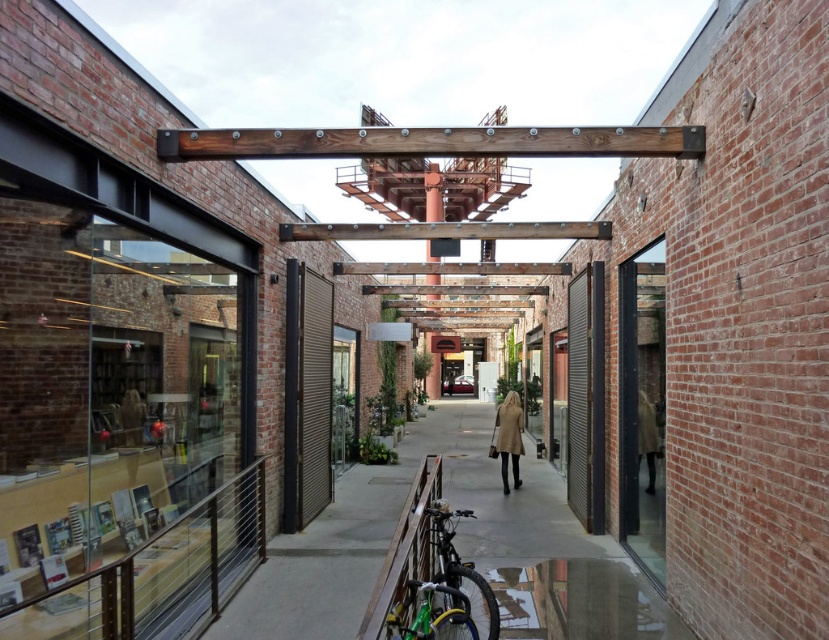
Question: Which is nearer to the green matte bicycle at lower center?

Choices:
 (A) matte beige trench coat at center
 (B) beige wool coat at center

Answer: (B)

Question: Which is nearer to the green matte bicycle at lower center?

Choices:
 (A) matte beige trench coat at center
 (B) beige wool coat at center

Answer: (B)

Question: Does green matte bicycle at lower center appear on the right side of matte beige trench coat at center?

Choices:
 (A) yes
 (B) no

Answer: (B)

Question: Does green matte bicycle at lower center have a larger size compared to beige wool coat at center?

Choices:
 (A) yes
 (B) no

Answer: (B)

Question: Which object is the farthest from the matte beige trench coat at center?

Choices:
 (A) beige wool coat at center
 (B) green matte bicycle at lower center

Answer: (B)

Question: Is green matte bicycle at lower center to the left of beige wool coat at center from the viewer's perspective?

Choices:
 (A) yes
 (B) no

Answer: (A)